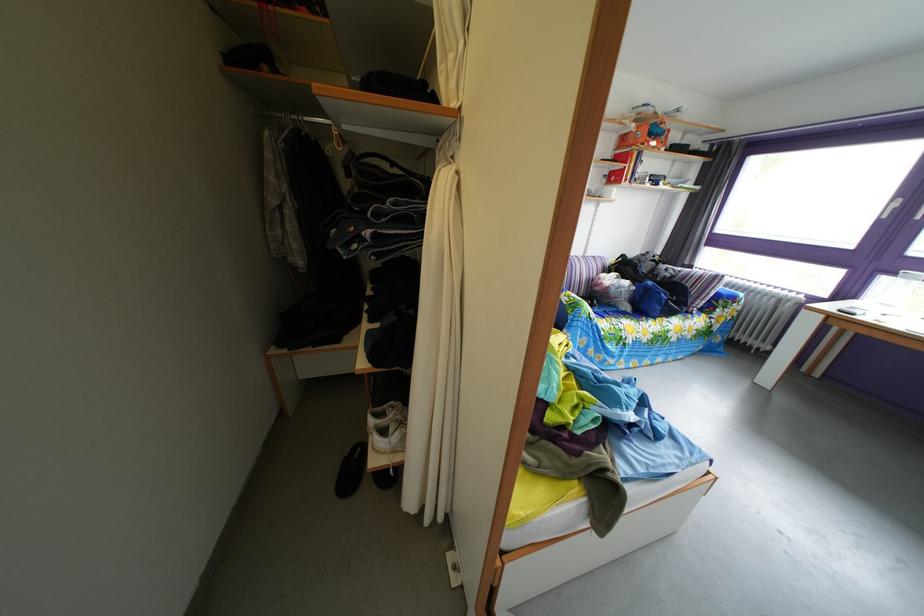
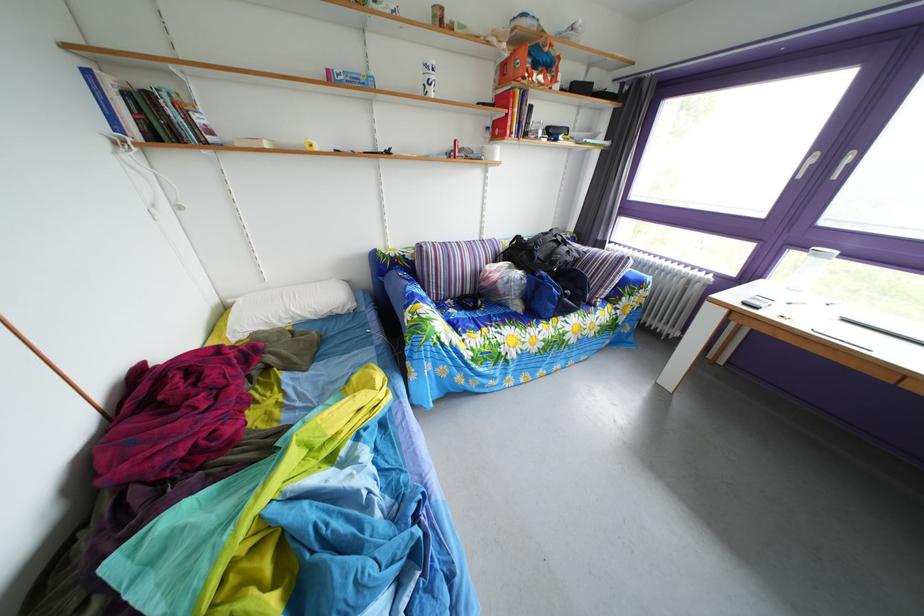
The point at (661,291) is marked in the first image. Where is the corresponding point in the second image?

(553, 282)